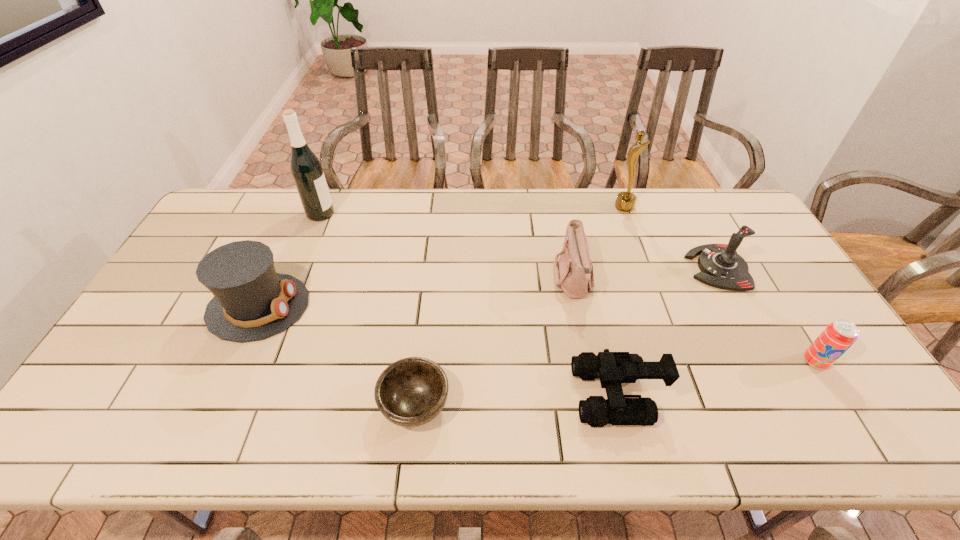
Find the location of `blank space located 0.240m on the front pocket of the shoulder bag`. blank space located 0.240m on the front pocket of the shoulder bag is located at coordinates (474, 281).

This screenshot has width=960, height=540. What are the coordinates of `vacant space positioned on the back of the soda can` in the screenshot? It's located at (798, 333).

What are the coordinates of `vacant space located 0.090m on the front lenses of the binoculars` in the screenshot? It's located at (538, 395).

This screenshot has height=540, width=960. Identify the location of free space located 0.200m on the front lenses of the binoculars. (492, 395).

At what (x,y) coordinates should I click in order to perform the action: click on free space located 0.210m on the front lenses of the binoculars. Please return your answer as a coordinate pair (x, y). The height and width of the screenshot is (540, 960). Looking at the image, I should click on (489, 395).

The height and width of the screenshot is (540, 960). Find the location of `vacant space located on the right of the shortest object`. vacant space located on the right of the shortest object is located at coordinates (505, 404).

In order to click on wine bottle present at the far edge in this screenshot , I will do pos(306,169).

Locate an element on the screen. This screenshot has width=960, height=540. award that is at the far edge is located at coordinates (625, 201).

You are a GUI agent. You are given a task and a screenshot of the screen. Output one action in this format:
    pyautogui.click(x=<x>, y=<y>)
    Task: Click on the binoculars positioned at the near edge
    This screenshot has width=960, height=540.
    Given the screenshot: What is the action you would take?
    pyautogui.click(x=612, y=368)

At what (x,y) coordinates should I click in order to perform the action: click on bowl located at the near edge. Please return your answer as a coordinate pair (x, y). The height and width of the screenshot is (540, 960). Looking at the image, I should click on (410, 392).